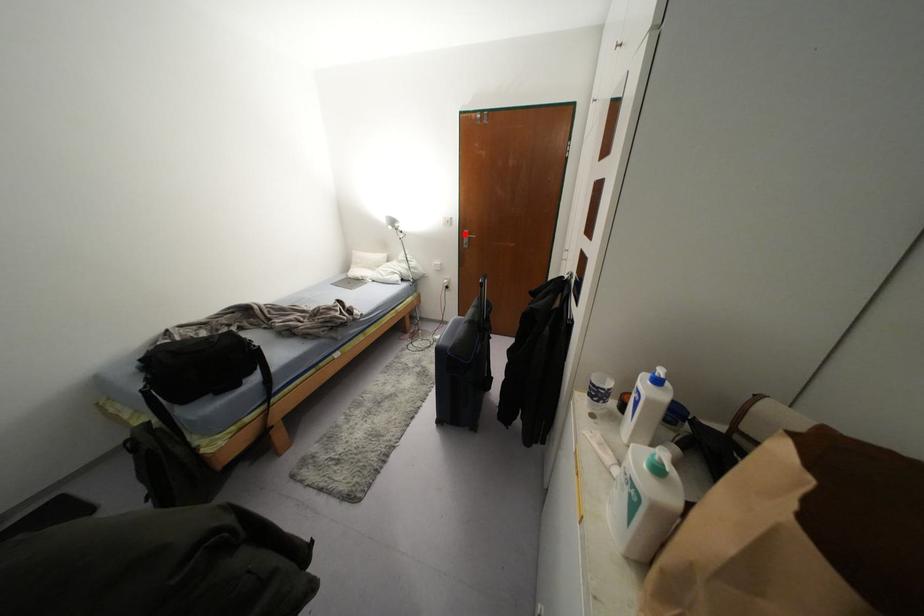
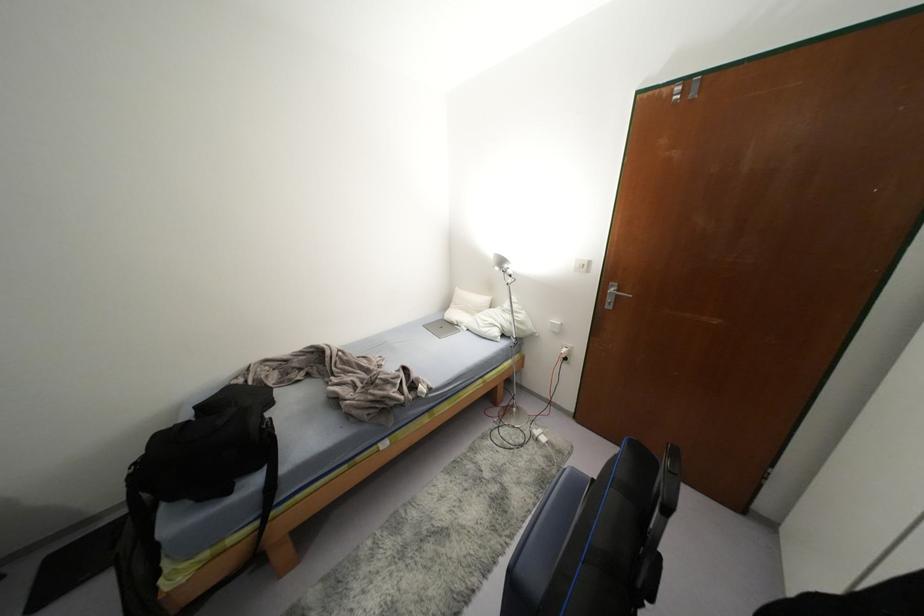
Find the pixel in the second image that matches the highlighted location in the first image.

(612, 289)